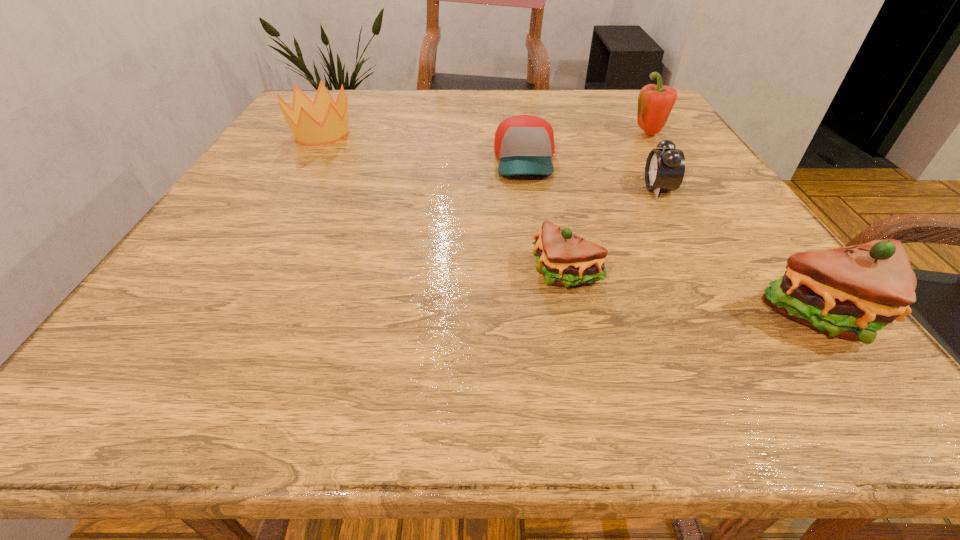
All sandwichs are currently evenly spaced. To continue this pattern, where would you add another sandwich on the left? Please point out a vacant spot. Please provide its 2D coordinates. Your answer should be formatted as a tuple, i.e. [(x, y)], where the tuple contains the x and y coordinates of a point satisfying the conditions above.

[(352, 236)]